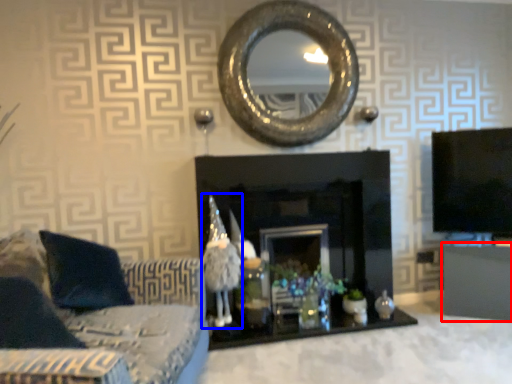
Question: Among these objects, which one is farthest to the camera, furniture (highlighted by a red box) or toy (highlighted by a blue box)?

Choices:
 (A) furniture
 (B) toy

Answer: (A)